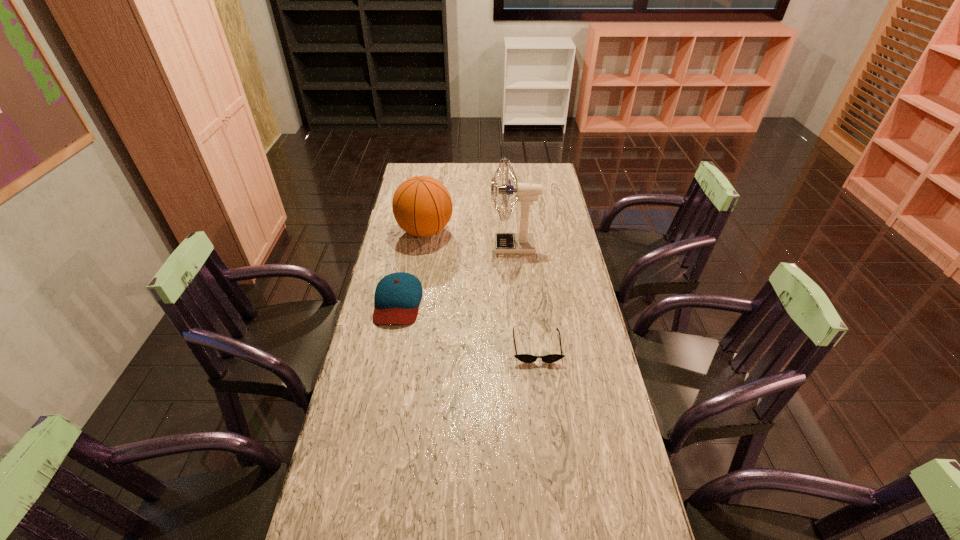
Locate an element on the screen. This screenshot has width=960, height=540. unoccupied area between the shortest object and the second shortest object is located at coordinates (468, 324).

Where is `free space that is in between the basketball and the baseball cap`? free space that is in between the basketball and the baseball cap is located at coordinates (412, 266).

Locate an element on the screen. The image size is (960, 540). free space between the second shortest object and the tallest object is located at coordinates (456, 273).

At what (x,y) coordinates should I click in order to perform the action: click on vacant area that lies between the basketball and the tallest object. Please return your answer as a coordinate pair (x, y). The width and height of the screenshot is (960, 540). Looking at the image, I should click on (469, 238).

Locate an element on the screen. The height and width of the screenshot is (540, 960). free space between the tallest object and the baseball cap is located at coordinates (456, 273).

The height and width of the screenshot is (540, 960). I want to click on free space between the tallest object and the shortest object, so pyautogui.click(x=525, y=296).

You are a GUI agent. You are given a task and a screenshot of the screen. Output one action in this format:
    pyautogui.click(x=<x>, y=<y>)
    Task: Click on the free point between the nearest object and the fan
    This screenshot has width=960, height=540.
    Given the screenshot: What is the action you would take?
    pyautogui.click(x=525, y=296)

The height and width of the screenshot is (540, 960). I want to click on free area in between the shortest object and the second nearest object, so point(468,324).

Identify the location of the second closest object to the fan. Image resolution: width=960 pixels, height=540 pixels. (397, 297).

Identify the location of object that is the closest to the shortest object. (397, 297).